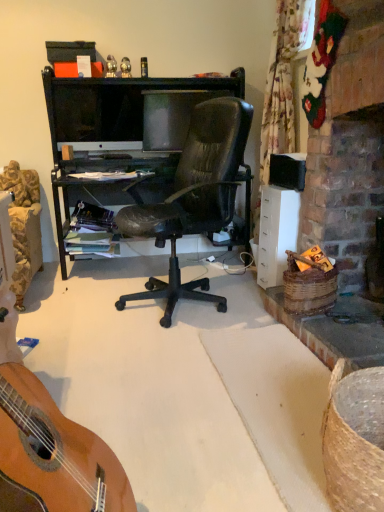
Where is `blank space situated above matte black monitor at center, marked as the 1th television in a left-to-right arrangement (from a real-world perspective)`? The width and height of the screenshot is (384, 512). blank space situated above matte black monitor at center, marked as the 1th television in a left-to-right arrangement (from a real-world perspective) is located at coordinates (104, 84).